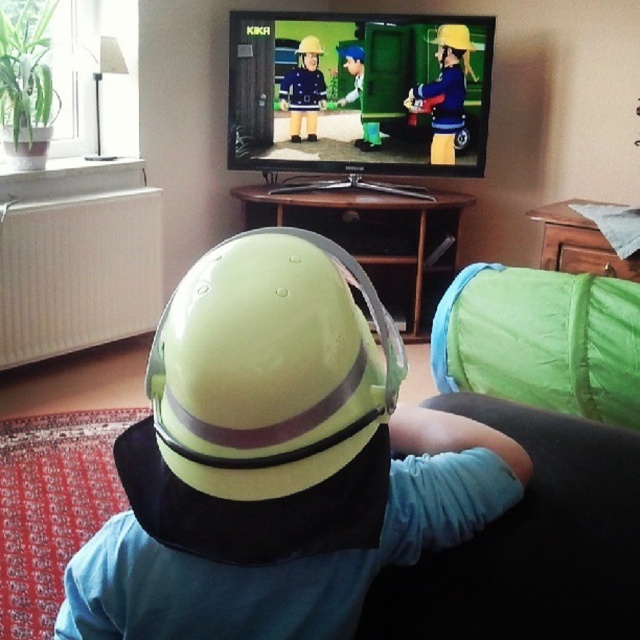
Question: Can you confirm if blue fabric at lower right is positioned to the right of matte blue uniform at center?

Choices:
 (A) yes
 (B) no

Answer: (A)

Question: Can you confirm if yellow matte helmet at upper center is thinner than blue fabric hat at center?

Choices:
 (A) no
 (B) yes

Answer: (A)

Question: Which point is closer to the camera?

Choices:
 (A) (316, 109)
 (B) (477, 550)
 (C) (432, 145)

Answer: (B)

Question: Which object is farther from the camera taking this photo?

Choices:
 (A) yellow matte helmet at upper center
 (B) blue fabric hat at center
 (C) glossy yellow helmet at center
 (D) blue fabric at lower right

Answer: (B)

Question: In this image, where is glossy yellow helmet at center located relative to yellow matte helmet at upper center?

Choices:
 (A) below
 (B) above

Answer: (A)

Question: Among these objects, which one is nearest to the camera?

Choices:
 (A) green fabric at lower right
 (B) yellow matte helmet at upper center
 (C) blue fabric at lower right

Answer: (C)